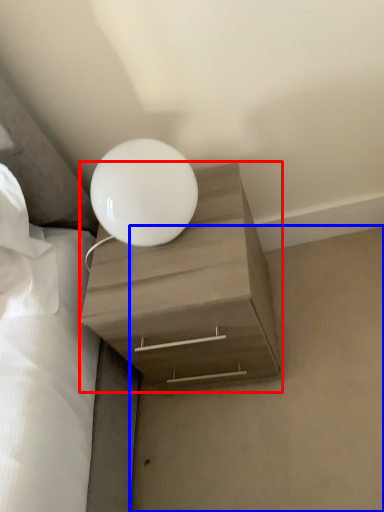
Question: Which of the following is the closest to the observer, nightstand (highlighted by a red box) or concrete (highlighted by a blue box)?

Choices:
 (A) nightstand
 (B) concrete

Answer: (A)